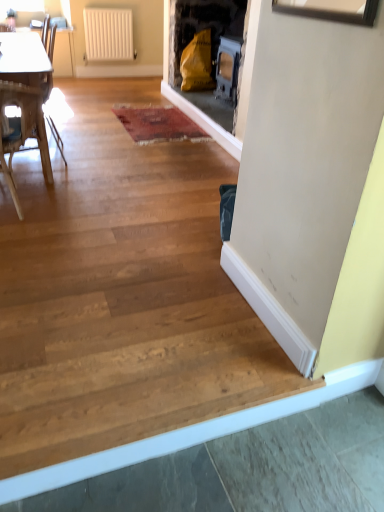
Locate an element on the screen. blank area beneath wooden chair at left (from a real-world perspective) is located at coordinates (29, 197).